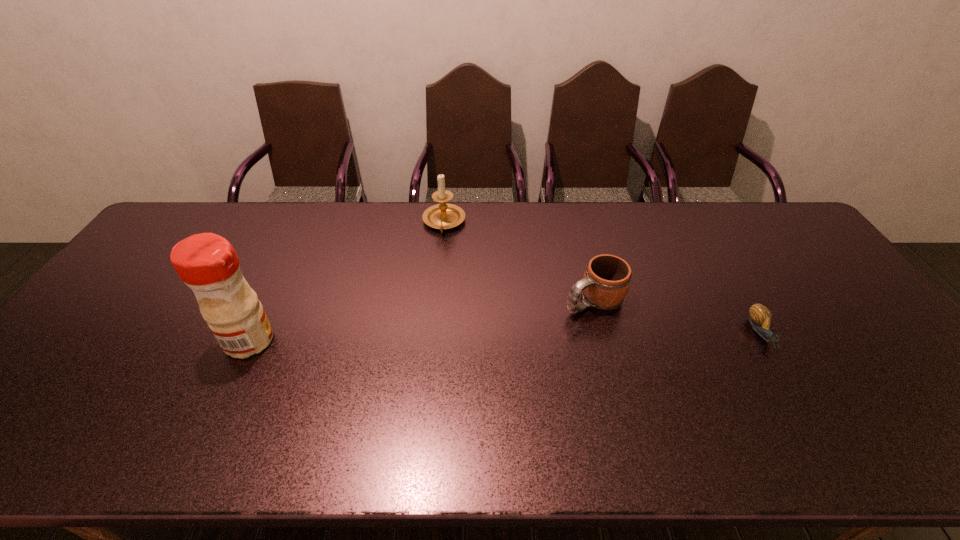
This screenshot has width=960, height=540. What are the coordinates of `condiment` in the screenshot? It's located at (207, 263).

Find the location of `the leftmost object`. the leftmost object is located at coordinates (207, 263).

Where is `the rightmost object`? The height and width of the screenshot is (540, 960). the rightmost object is located at coordinates coord(760,317).

The image size is (960, 540). I want to click on escargot, so click(760, 317).

The width and height of the screenshot is (960, 540). In order to click on the second shortest object in this screenshot , I will do `click(606, 280)`.

Locate an element on the screen. This screenshot has height=540, width=960. mug is located at coordinates (606, 280).

Identify the location of the third shortest object. (441, 216).

Find the location of a particular element. This screenshot has width=960, height=540. the second object from left to right is located at coordinates (441, 216).

The image size is (960, 540). Identify the location of free space located 0.210m on the left of the leftmost object. (145, 341).

Locate an element on the screen. Image resolution: width=960 pixels, height=540 pixels. free space located 0.170m on the front-facing side of the escargot is located at coordinates (809, 415).